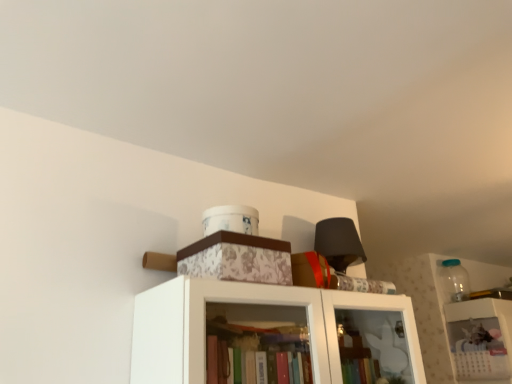
Question: From a real-world perspective, is transparent glass jar at upper right positioned above or below floral-patterned cardboard box at upper center?

Choices:
 (A) below
 (B) above

Answer: (B)

Question: In the image, is transparent glass jar at upper right positioned in front of or behind floral-patterned cardboard box at upper center?

Choices:
 (A) behind
 (B) front

Answer: (A)

Question: Which is nearer to the transparent glass jar at upper right?

Choices:
 (A) floral-patterned cardboard box at upper center
 (B) white paper calendar at upper right

Answer: (B)

Question: Which is farther from the floral-patterned cardboard box at upper center?

Choices:
 (A) white paper calendar at upper right
 (B) transparent glass jar at upper right

Answer: (B)